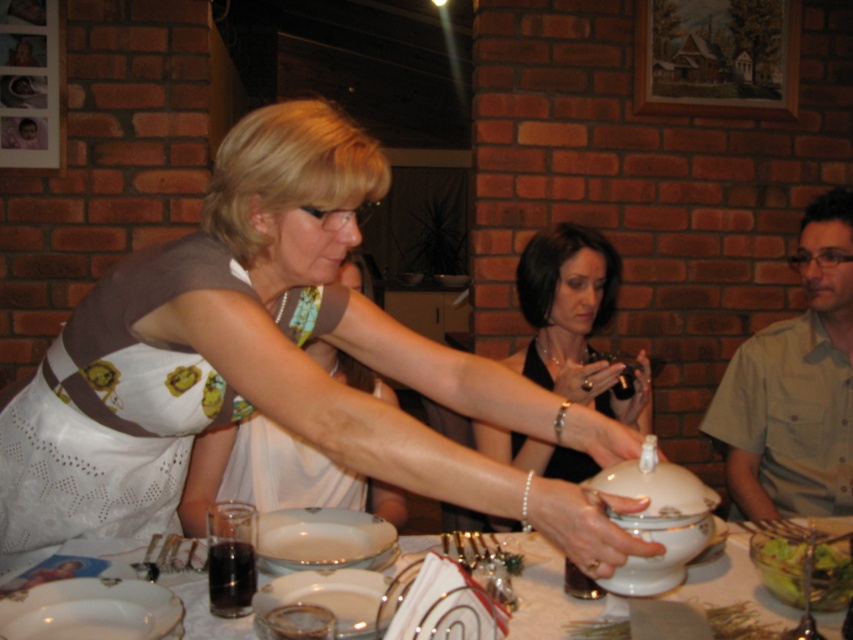
You are a guest at this dinner party and need to choose between the white lace dress at center and the white porcelain platter at lower left. Which one is bigger?

The white lace dress at center is larger in size than the white porcelain platter at lower left.

You are a photographer at the event and want to take a photo of the white glossy platter at center. However, there is a matte black camera at center in the way. Can you move the camera to the side to get an unobstructed view?

The matte black camera at center is located above the white glossy platter at center, so moving it to the side would allow an unobstructed view of the white glossy platter at center.